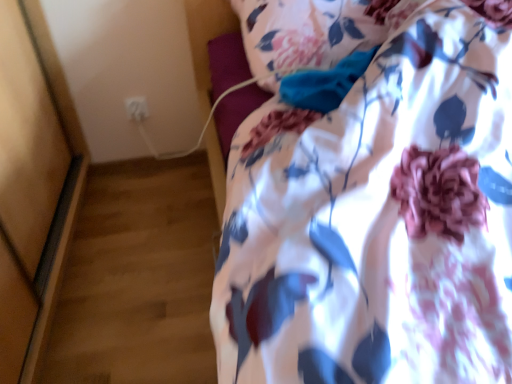
The image size is (512, 384). Describe the element at coordinates (311, 33) in the screenshot. I see `floral fabric pillow at upper center` at that location.

Find the location of a particular element. This screenshot has width=512, height=384. floral fabric pillow at upper center is located at coordinates point(311,33).

Identify the location of white plastic electric outlet at upper left. (137, 108).

Measure the distance between white plastic electric outlet at upper left and camera.

The depth of white plastic electric outlet at upper left is 1.71 meters.

What do you see at coordinates (137, 108) in the screenshot? The image size is (512, 384). I see `white plastic electric outlet at upper left` at bounding box center [137, 108].

You are a GUI agent. You are given a task and a screenshot of the screen. Output one action in this format:
    pyautogui.click(x=<x>, y=<y>)
    Task: Click on the floral fabric pillow at upper center
    The width and height of the screenshot is (512, 384).
    Given the screenshot: What is the action you would take?
    pyautogui.click(x=311, y=33)

Between white plastic electric outlet at upper left and floral fabric pillow at upper center, which one appears on the right side from the viewer's perspective?

floral fabric pillow at upper center is more to the right.

Considering the relative positions of white plastic electric outlet at upper left and floral fabric pillow at upper center in the image provided, is white plastic electric outlet at upper left in front of floral fabric pillow at upper center?

No, white plastic electric outlet at upper left is further to the viewer.

Which is more distant, (136,117) or (312,12)?

The point (136,117) is more distant.

From the image's perspective, is white plastic electric outlet at upper left above or below floral fabric pillow at upper center?

white plastic electric outlet at upper left is situated lower than floral fabric pillow at upper center in the image.

From a real-world perspective, which object rests below the other?

From a 3D spatial view, white plastic electric outlet at upper left is below.

Consider the image. Considering the relative sizes of white plastic electric outlet at upper left and floral fabric pillow at upper center in the image provided, is white plastic electric outlet at upper left wider than floral fabric pillow at upper center?

Incorrect, the width of white plastic electric outlet at upper left does not surpass that of floral fabric pillow at upper center.

Who is shorter, white plastic electric outlet at upper left or floral fabric pillow at upper center?

white plastic electric outlet at upper left is shorter.

Consider the image. Does white plastic electric outlet at upper left have a larger size compared to floral fabric pillow at upper center?

No.

Which is correct: white plastic electric outlet at upper left is inside floral fabric pillow at upper center, or outside of it?

white plastic electric outlet at upper left is spatially situated outside floral fabric pillow at upper center.

Is white plastic electric outlet at upper left far from floral fabric pillow at upper center?

white plastic electric outlet at upper left is near floral fabric pillow at upper center, not far away.

Is white plastic electric outlet at upper left looking in the opposite direction of floral fabric pillow at upper center?

No.

Looking at this image, what's the angular difference between white plastic electric outlet at upper left and floral fabric pillow at upper center's facing directions?

0.313 degrees separate the facing orientations of white plastic electric outlet at upper left and floral fabric pillow at upper center.

How far apart are white plastic electric outlet at upper left and floral fabric pillow at upper center?

A distance of 92.31 centimeters exists between white plastic electric outlet at upper left and floral fabric pillow at upper center.

You are a GUI agent. You are given a task and a screenshot of the screen. Output one action in this format:
    pyautogui.click(x=<x>, y=<y>)
    Task: Click on the pillow above the white plastic electric outlet at upper left (from the image's perspective)
    Image resolution: width=512 pixels, height=384 pixels.
    Given the screenshot: What is the action you would take?
    pyautogui.click(x=311, y=33)

Would you say floral fabric pillow at upper center is to the left or to the right of white plastic electric outlet at upper left in the picture?

Based on their positions, floral fabric pillow at upper center is located to the right of white plastic electric outlet at upper left.

In the image, is floral fabric pillow at upper center positioned in front of or behind white plastic electric outlet at upper left?

floral fabric pillow at upper center is in front of white plastic electric outlet at upper left.

Does point (395, 26) come closer to viewer compared to point (141, 118)?

Yes, point (395, 26) is in front of point (141, 118).

From the picture: From the image's perspective, is floral fabric pillow at upper center positioned above or below white plastic electric outlet at upper left?

floral fabric pillow at upper center is situated higher than white plastic electric outlet at upper left in the image.

From a real-world perspective, is floral fabric pillow at upper center under white plastic electric outlet at upper left?

No, from a real-world perspective, floral fabric pillow at upper center is not under white plastic electric outlet at upper left.

Considering the sizes of floral fabric pillow at upper center and white plastic electric outlet at upper left in the image, is floral fabric pillow at upper center wider or thinner than white plastic electric outlet at upper left?

In the image, floral fabric pillow at upper center appears to be wider than white plastic electric outlet at upper left.

Which of these two, floral fabric pillow at upper center or white plastic electric outlet at upper left, stands shorter?

With less height is white plastic electric outlet at upper left.

Between floral fabric pillow at upper center and white plastic electric outlet at upper left, which one has larger size?

Bigger between the two is floral fabric pillow at upper center.

Is white plastic electric outlet at upper left completely or partially inside floral fabric pillow at upper center?

That's incorrect, white plastic electric outlet at upper left is not inside floral fabric pillow at upper center.

Are floral fabric pillow at upper center and white plastic electric outlet at upper left beside each other?

They are not placed beside each other.

Is floral fabric pillow at upper center oriented away from white plastic electric outlet at upper left?

No, floral fabric pillow at upper center is not facing the opposite direction of white plastic electric outlet at upper left.

Measure the distance from floral fabric pillow at upper center to white plastic electric outlet at upper left.

The distance of floral fabric pillow at upper center from white plastic electric outlet at upper left is 36.34 inches.

Where is `pillow that appears above the white plastic electric outlet at upper left (from a real-world perspective)`? The image size is (512, 384). pillow that appears above the white plastic electric outlet at upper left (from a real-world perspective) is located at coordinates (311, 33).

Locate an element on the screen. Image resolution: width=512 pixels, height=384 pixels. pillow that appears above the white plastic electric outlet at upper left (from the image's perspective) is located at coordinates (311, 33).

This screenshot has height=384, width=512. In order to click on pillow on the right of white plastic electric outlet at upper left in this screenshot , I will do `click(311, 33)`.